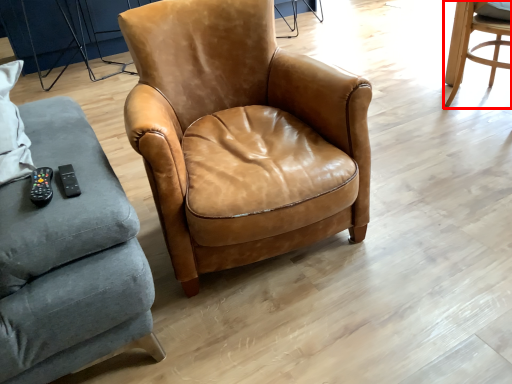
Question: From the image's perspective, what is the correct spatial positioning of chair (annotated by the red box) in reference to chair?

Choices:
 (A) above
 (B) below

Answer: (A)